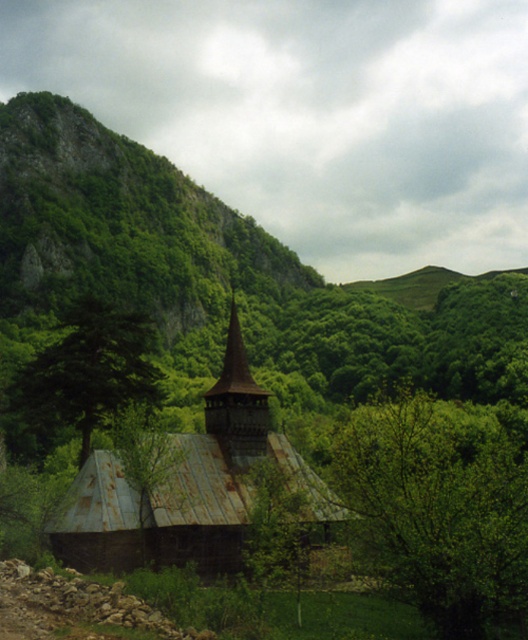
Is rusty metal church at center smaller than green matte tree at center-left?

Correct, rusty metal church at center occupies less space than green matte tree at center-left.

How much distance is there between rusty metal church at center and green matte tree at center-left?

The distance of rusty metal church at center from green matte tree at center-left is 9.94 meters.

Who is more forward, [164,476] or [157,394]?

Point [164,476] is in front.

At what (x,y) coordinates should I click in order to perform the action: click on rusty metal church at center. Please return your answer as a coordinate pair (x, y). Looking at the image, I should click on (186, 486).

Is point (476, 538) closer to camera compared to point (119, 344)?

Yes, it is.

Does green leafy tree at center come behind green matte tree at center-left?

No, green leafy tree at center is closer to the viewer.

Where is `green leafy tree at center`? The width and height of the screenshot is (528, 640). green leafy tree at center is located at coordinates (439, 508).

From the picture: Which is more to the right, green leafy tree at center or rusty metal church at center?

From the viewer's perspective, green leafy tree at center appears more on the right side.

Which of these two, green leafy tree at center or rusty metal church at center, stands taller?

With more height is rusty metal church at center.

Is point (482, 548) positioned before point (116, 509)?

Yes, it is.

I want to click on green leafy tree at center, so click(439, 508).